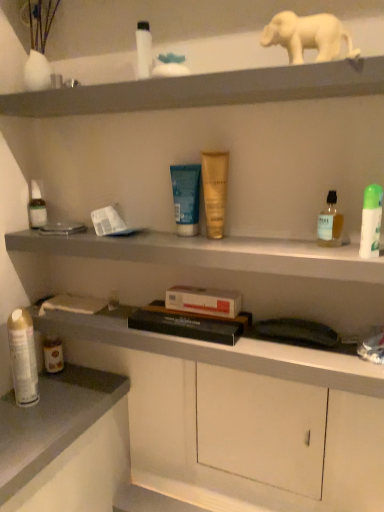
The height and width of the screenshot is (512, 384). I want to click on empty space that is in between blue matte tube at center, placed as the 3th toiletry when sorted from left to right, and translucent plastic bottle at left, arranged as the first toiletry when viewed from the back, so click(116, 231).